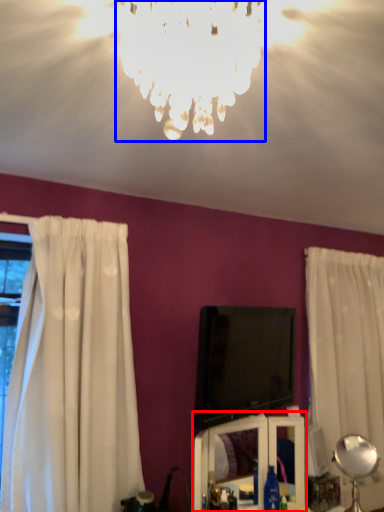
Question: Which object is closer to the camera taking this photo, vanity (highlighted by a red box) or lamp (highlighted by a blue box)?

Choices:
 (A) vanity
 (B) lamp

Answer: (B)